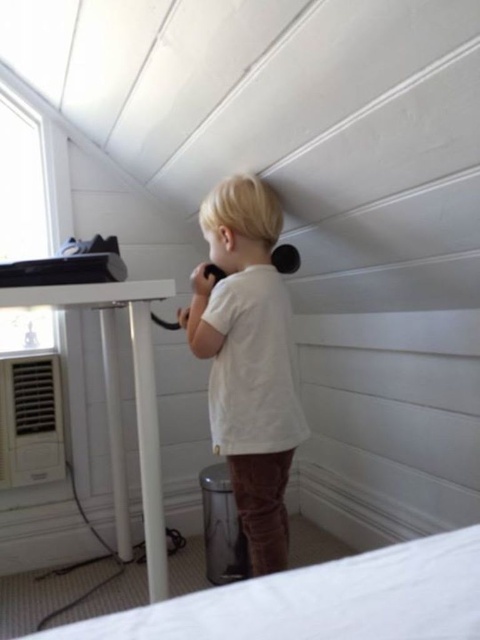
In the scene shown: You are a parent trying to put your child to bed. The child is wearing a white cotton shirt at center and is currently standing near the white fabric bed at lower center. How far apart are the child and the bed?

The distance between the white cotton shirt at center and the white fabric bed at lower center is 33.26 inches.

The child is wearing a white cotton shirt at center and standing near a white fabric bed at lower center. Which object is wider?

The white fabric bed at lower center is wider than the white cotton shirt at center.